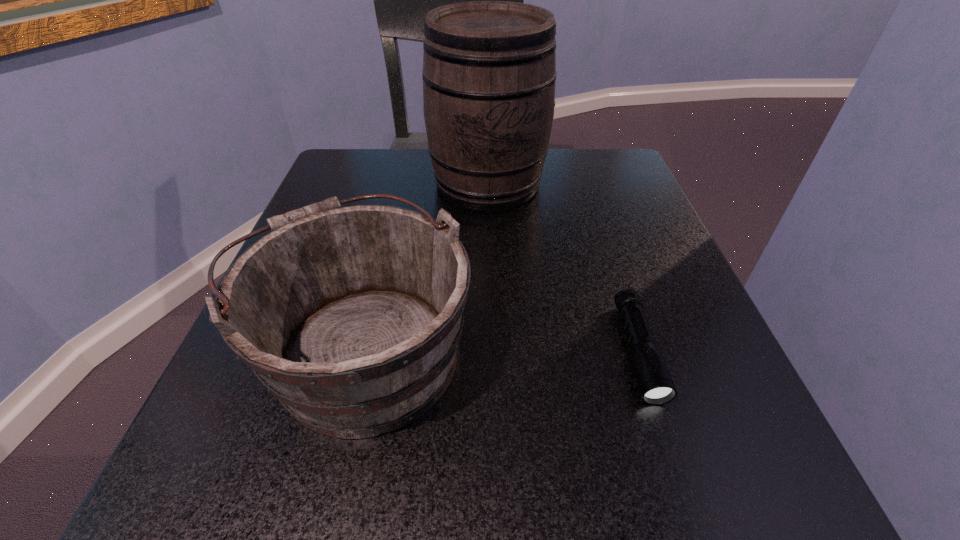
At what (x,y) coordinates should I click in order to perform the action: click on the taller wine bucket. Please return your answer as a coordinate pair (x, y). Image resolution: width=960 pixels, height=540 pixels. Looking at the image, I should click on (489, 67).

Where is `the farthest object`? The height and width of the screenshot is (540, 960). the farthest object is located at coordinates [489, 67].

Locate an element on the screen. This screenshot has width=960, height=540. the second tallest object is located at coordinates (351, 316).

Locate an element on the screen. the nearer wine bucket is located at coordinates (351, 316).

Where is `flashlight`? flashlight is located at coordinates (655, 383).

You are a GUI agent. You are given a task and a screenshot of the screen. Output one action in this format:
    pyautogui.click(x=<x>, y=<y>)
    Task: Click on the shortest object
    This screenshot has width=960, height=540.
    Given the screenshot: What is the action you would take?
    pyautogui.click(x=655, y=383)

Where is `free location located on the left of the tallest object`? The image size is (960, 540). free location located on the left of the tallest object is located at coordinates (366, 183).

Identify the location of free space located on the front of the nearer wine bucket. The height and width of the screenshot is (540, 960). pos(326,501).

This screenshot has height=540, width=960. In order to click on vacant space situated 0.100m at the lens end of the shortest object in this screenshot , I will do `click(681, 485)`.

Locate an element on the screen. object present at the far edge is located at coordinates (x=489, y=67).